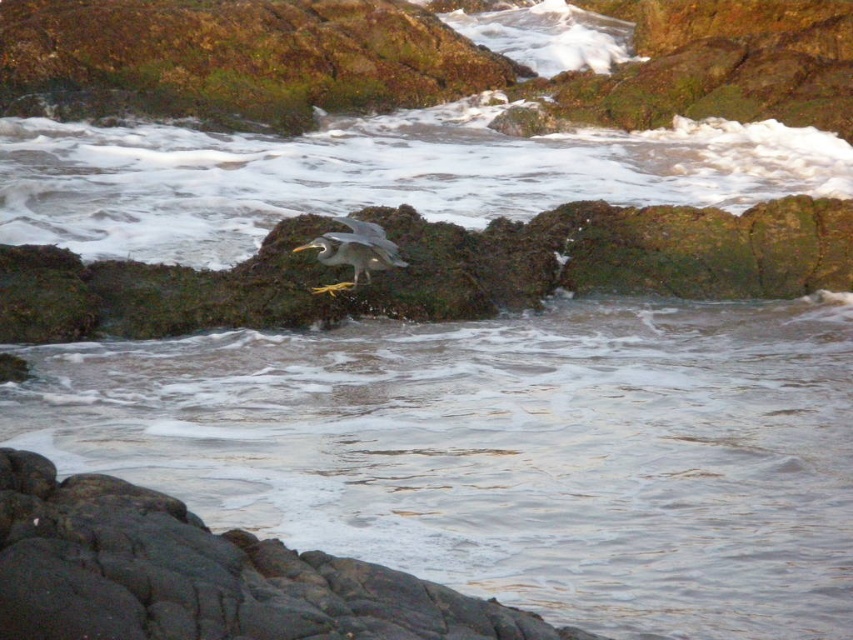
Who is higher up, smooth gray rock at lower center or gray matte bird at center?

gray matte bird at center is higher up.

The height and width of the screenshot is (640, 853). Describe the element at coordinates (201, 576) in the screenshot. I see `smooth gray rock at lower center` at that location.

Who is more forward, (192, 552) or (338, 240)?

Point (192, 552) is more forward.

What are the coordinates of `smooth gray rock at lower center` in the screenshot? It's located at (201, 576).